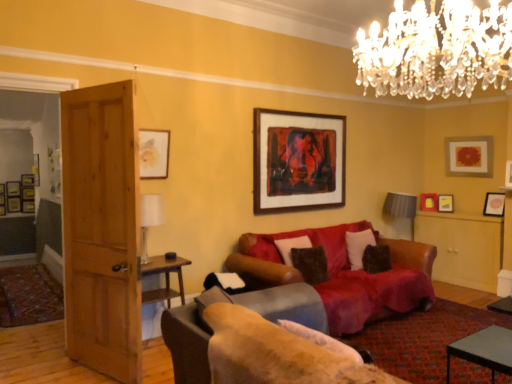
Question: Is wooden framed artwork at upper center, marked as the 9th picture frame in a back-to-front arrangement, to the left or to the right of gray fabric lampshade at right, the first lamp positioned from the right, in the image?

Choices:
 (A) left
 (B) right

Answer: (A)

Question: From the image's perspective, is wooden framed artwork at upper center, marked as the 9th picture frame in a back-to-front arrangement, located above or below gray fabric lampshade at right, acting as the 1th lamp starting from the back?

Choices:
 (A) below
 (B) above

Answer: (B)

Question: Considering the real-world distances, which object is farthest from the clear crystal chandelier at upper center, arranged as the first lamp when viewed from the front?

Choices:
 (A) matte gold picture frame at upper left, placed as the 1th picture frame when sorted from front to back
 (B) wooden picture frame at left, the ninth picture frame from the right
 (C) metallic gold picture frame at left, the seventh picture frame in the front-to-back sequence
 (D) white soft pillow at right, acting as the first pillow starting from the right
 (E) white glossy table at lower right

Answer: (B)

Question: Estimate the real-world distances between objects in this image. Which object is farther from the velvet dark brown pillow at center, positioned as the second pillow in back-to-front order?

Choices:
 (A) white glass lamp at left, the 2th lamp viewed from the top
 (B) leather couch at center, the 2th studio couch when ordered from front to back
 (C) white glossy table at lower right
 (D) wooden picture frame at left, placed as the eighth picture frame when sorted from right to left
 (E) gray fabric lampshade at right, the third lamp from the top

Answer: (D)